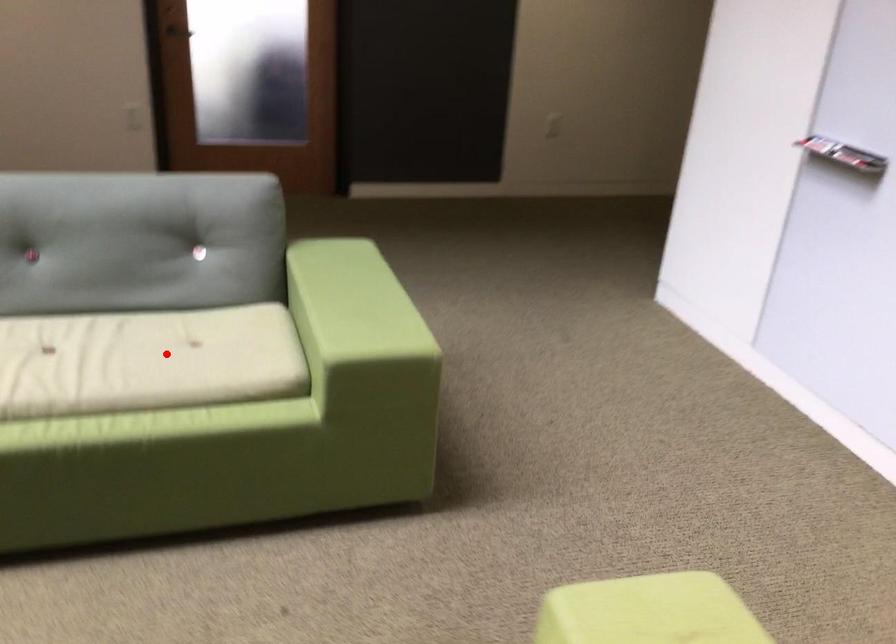
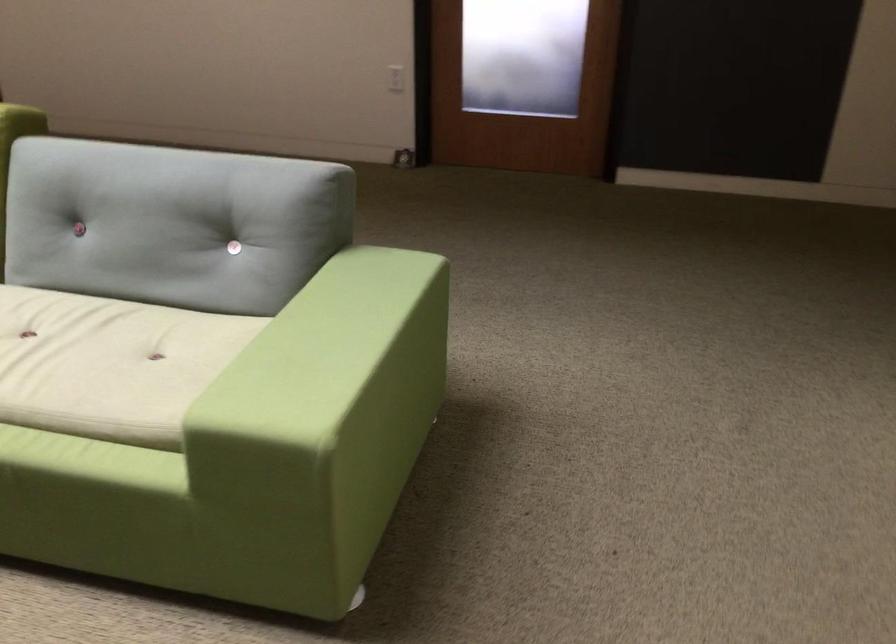
Question: I am providing you with two images of the same scene from different viewpoints. A red point is shown in image1. For the corresponding object point in image2, is it positioned nearer or farther from the camera?

Choices:
 (A) Nearer
 (B) Farther

Answer: (A)